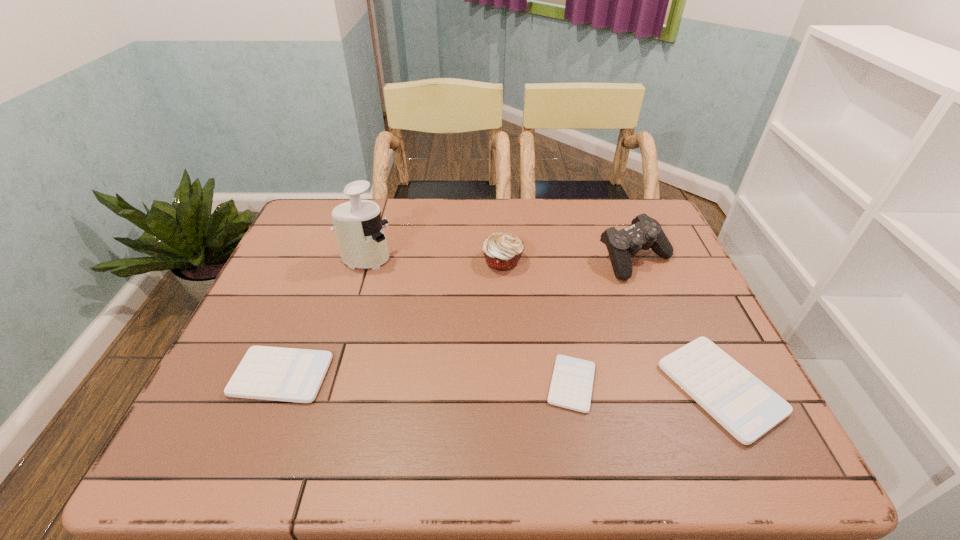
Where is `object that is at the near right corner`? object that is at the near right corner is located at coordinates (747, 408).

Identify the location of vacant area at the far edge. The width and height of the screenshot is (960, 540). (545, 217).

Locate an element on the screen. This screenshot has height=540, width=960. vacant space at the near edge of the desktop is located at coordinates (365, 407).

Where is `vacant space at the left edge`? The image size is (960, 540). vacant space at the left edge is located at coordinates (284, 253).

In order to click on free space at the right edge in this screenshot , I will do `click(642, 253)`.

I want to click on vacant space at the far left corner of the desktop, so click(x=307, y=227).

Identify the location of vacant space at the near left corner of the desktop. (231, 416).

The width and height of the screenshot is (960, 540). Identify the location of free space between the leftmost calculator and the muffin. (392, 318).

Identify the location of vacant area that lies between the third object from left to right and the rightmost calculator. (612, 325).

Identify the location of vacant space that's between the tallest object and the rightmost calculator. This screenshot has width=960, height=540. (543, 324).